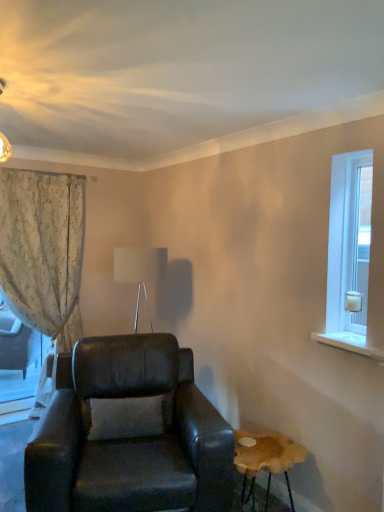
Where is `free spot above wooden stool at lower right (from a real-world perspective)`? This screenshot has height=512, width=384. free spot above wooden stool at lower right (from a real-world perspective) is located at coordinates (269, 446).